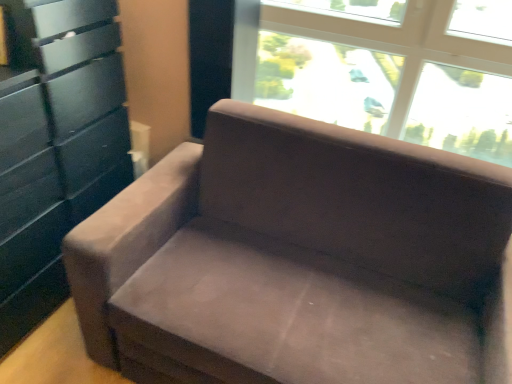
The height and width of the screenshot is (384, 512). Describe the element at coordinates (384, 68) in the screenshot. I see `transparent glass window at upper center` at that location.

In order to face matte black dresser at left, should I rotate leftwards or rightwards?

A 25.360 degree turn to the left will do.

This screenshot has height=384, width=512. I want to click on transparent glass window at upper center, so click(384, 68).

This screenshot has width=512, height=384. What are the coordinates of `window above the suede couch at center (from the image's perspective)` in the screenshot? It's located at (384, 68).

Is transparent glass window at upper center placed right next to suede couch at center?

No, transparent glass window at upper center is not with suede couch at center.

Could suede couch at center be considered to be inside transparent glass window at upper center?

Actually, suede couch at center is outside transparent glass window at upper center.

Measure the distance between transparent glass window at upper center and suede couch at center.

The distance of transparent glass window at upper center from suede couch at center is 1.01 meters.

Can you confirm if suede couch at center is bigger than matte black dresser at left?

Indeed, suede couch at center has a larger size compared to matte black dresser at left.

Are suede couch at center and matte black dresser at left located far from each other?

No, suede couch at center is not far from matte black dresser at left.

Considering the positions of objects suede couch at center and matte black dresser at left in the image provided, who is more to the right, suede couch at center or matte black dresser at left?

suede couch at center.

From the image's perspective, is suede couch at center positioned above or below matte black dresser at left?

suede couch at center is below matte black dresser at left.

Can you confirm if matte black dresser at left is positioned to the left of transparent glass window at upper center?

Correct, you'll find matte black dresser at left to the left of transparent glass window at upper center.

Considering the relative sizes of matte black dresser at left and transparent glass window at upper center in the image provided, is matte black dresser at left wider than transparent glass window at upper center?

Yes.

From the image's perspective, which is above, matte black dresser at left or transparent glass window at upper center?

transparent glass window at upper center, from the image's perspective.

Considering the positions of point (70, 218) and point (277, 6), is point (70, 218) closer or farther from the camera than point (277, 6)?

Point (70, 218) appears to be closer to the viewer than point (277, 6).

Where is `studio couch that is below the matte black dresser at left (from the image's perspective)`? This screenshot has height=384, width=512. studio couch that is below the matte black dresser at left (from the image's perspective) is located at coordinates (294, 258).

How distant is matte black dresser at left from suede couch at center?

matte black dresser at left and suede couch at center are 25.78 inches apart.

Are matte black dresser at left and suede couch at center located far from each other?

Actually, matte black dresser at left and suede couch at center are a little close together.

Does matte black dresser at left come behind suede couch at center?

Yes, it is behind suede couch at center.

Is suede couch at center positioned with its back to transparent glass window at upper center?

Correct, suede couch at center is looking away from transparent glass window at upper center.

Which is in front, suede couch at center or transparent glass window at upper center?

Positioned in front is suede couch at center.

Are suede couch at center and transparent glass window at upper center located far from each other?

Yes.

From a real-world perspective, which is physically below, suede couch at center or transparent glass window at upper center?

From a 3D spatial view, suede couch at center is below.

Is transparent glass window at upper center positioned far away from matte black dresser at left?

Indeed, transparent glass window at upper center is not near matte black dresser at left.

Is transparent glass window at upper center completely or partially outside of matte black dresser at left?

That's correct, transparent glass window at upper center is outside of matte black dresser at left.

Is point (345, 121) less distant than point (50, 190)?

That is False.

Considering the sizes of transparent glass window at upper center and matte black dresser at left in the image, is transparent glass window at upper center wider or thinner than matte black dresser at left?

Considering their sizes, transparent glass window at upper center looks slimmer than matte black dresser at left.

The height and width of the screenshot is (384, 512). Find the location of `studio couch that appears below the transparent glass window at upper center (from a real-world perspective)`. studio couch that appears below the transparent glass window at upper center (from a real-world perspective) is located at coordinates (294, 258).

Find the location of a particular element. Image resolution: width=512 pixels, height=384 pixels. studio couch in front of the matte black dresser at left is located at coordinates (294, 258).

Estimate the real-world distances between objects in this image. Which object is further from suede couch at center, transparent glass window at upper center or matte black dresser at left?

transparent glass window at upper center.

When comparing their distances from transparent glass window at upper center, does matte black dresser at left or suede couch at center seem further?

The object further to transparent glass window at upper center is matte black dresser at left.

Based on their spatial positions, is suede couch at center or matte black dresser at left closer to transparent glass window at upper center?

suede couch at center is positioned closer to the anchor transparent glass window at upper center.

Considering their positions, is matte black dresser at left positioned further to suede couch at center than transparent glass window at upper center?

Based on the image, transparent glass window at upper center appears to be further to suede couch at center.

From the image, which object appears to be farther from matte black dresser at left, suede couch at center or transparent glass window at upper center?

Among the two, transparent glass window at upper center is located further to matte black dresser at left.

From the image, which object appears to be farther from matte black dresser at left, transparent glass window at upper center or suede couch at center?

Based on the image, transparent glass window at upper center appears to be further to matte black dresser at left.

The height and width of the screenshot is (384, 512). In order to click on studio couch between matte black dresser at left and transparent glass window at upper center in this screenshot , I will do `click(294, 258)`.